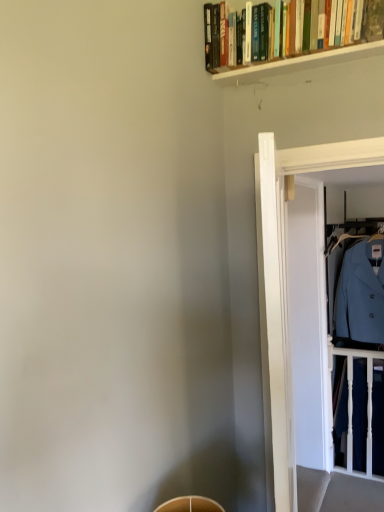
Question: Is point (347, 297) positioned closer to the camera than point (377, 355)?

Choices:
 (A) farther
 (B) closer

Answer: (A)

Question: Considering their positions, is light blue woolen coat at right located in front of or behind white wooden balustrade at right?

Choices:
 (A) behind
 (B) front

Answer: (B)

Question: Which is nearer to the transparent glass door at right?

Choices:
 (A) light blue woolen coat at right
 (B) white wooden balustrade at right

Answer: (A)

Question: Which of these objects is positioned closest to the white wooden balustrade at right?

Choices:
 (A) transparent glass door at right
 (B) light blue woolen coat at right

Answer: (B)